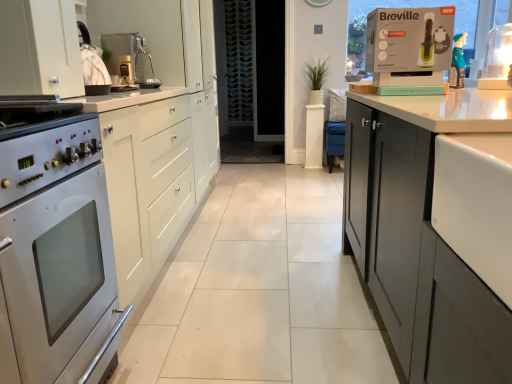
Question: Relative to matte white box at upper right, is white glossy countertop at right in front or behind?

Choices:
 (A) behind
 (B) front

Answer: (B)

Question: Is white glossy countertop at right situated inside matte white box at upper right or outside?

Choices:
 (A) inside
 (B) outside

Answer: (B)

Question: Which object is positioned farthest from the white matte cabinet at left?

Choices:
 (A) white glossy countertop at right
 (B) matte white box at upper right
 (C) white glossy lamp at upper right
 (D) metallic silver coffee machine at upper center
 (E) satin silver oven at left

Answer: (C)

Question: Considering the real-world distances, which object is farthest from the white glossy countertop at right?

Choices:
 (A) white glossy lamp at upper right
 (B) metallic silver coffee machine at upper center
 (C) white matte cabinet at left
 (D) matte white box at upper right
 (E) satin silver oven at left

Answer: (A)